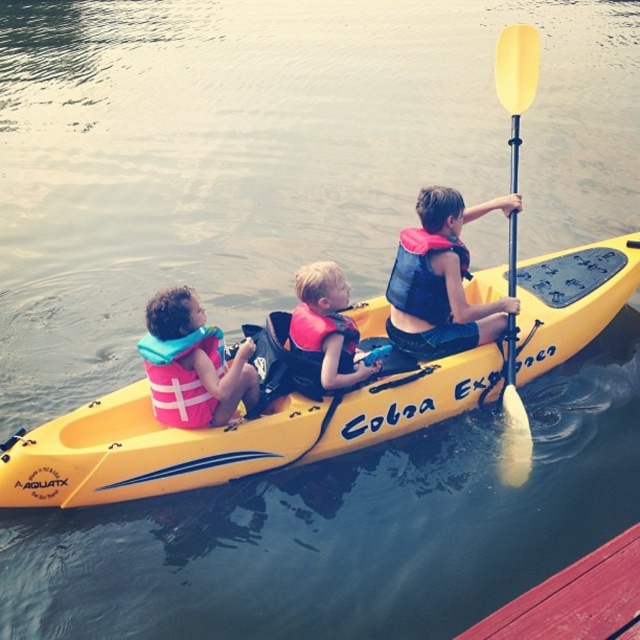
Does yellow plastic canoe at center appear on the left side of pink life jacket at center?

Yes, yellow plastic canoe at center is to the left of pink life jacket at center.

This screenshot has width=640, height=640. I want to click on yellow plastic canoe at center, so click(228, 435).

Who is more distant from viewer, (506, 200) or (193, 412)?

Point (506, 200)

Is blue life vest at center thinner than pink life vest at left?

No, blue life vest at center is not thinner than pink life vest at left.

Identify the location of blue life vest at center. (442, 280).

Image resolution: width=640 pixels, height=640 pixels. What do you see at coordinates (442, 280) in the screenshot?
I see `blue life vest at center` at bounding box center [442, 280].

Is blue life vest at center bigger than yellow matte paddle at upper right?

Correct, blue life vest at center is larger in size than yellow matte paddle at upper right.

Does point (435, 344) come closer to viewer compared to point (500, 449)?

Yes.

Locate an element on the screen. The height and width of the screenshot is (640, 640). blue life vest at center is located at coordinates (442, 280).